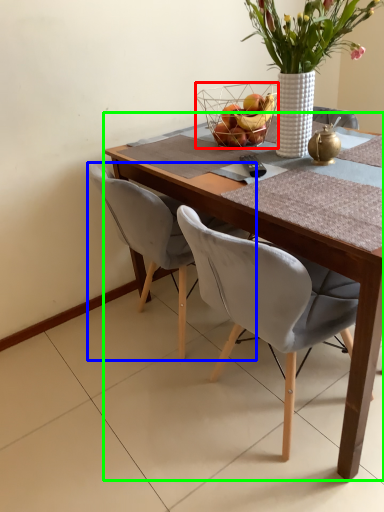
Question: Which is nearer to the basket (highlighted by a red box)? chair (highlighted by a blue box) or round table (highlighted by a green box).

Choices:
 (A) chair
 (B) round table

Answer: (A)